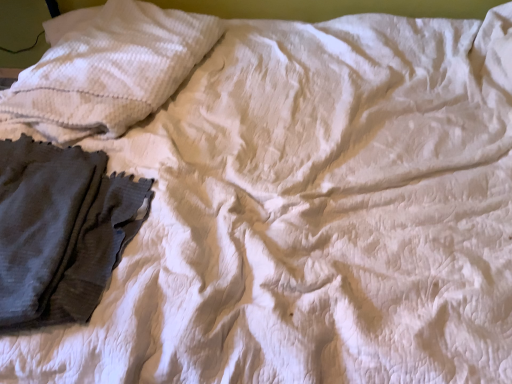
Question: Does white textured pillow at upper left have a smaller size compared to dark gray textured fabric at left?

Choices:
 (A) yes
 (B) no

Answer: (B)

Question: Is white textured pillow at upper left positioned with its back to dark gray textured fabric at left?

Choices:
 (A) no
 (B) yes

Answer: (A)

Question: Is white textured pillow at upper left thinner than dark gray textured fabric at left?

Choices:
 (A) no
 (B) yes

Answer: (A)

Question: Could you tell me if white textured pillow at upper left is turned towards dark gray textured fabric at left?

Choices:
 (A) no
 (B) yes

Answer: (A)

Question: Is dark gray textured fabric at left located within white textured pillow at upper left?

Choices:
 (A) no
 (B) yes

Answer: (A)

Question: Can you confirm if white textured pillow at upper left is wider than dark gray textured fabric at left?

Choices:
 (A) no
 (B) yes

Answer: (B)

Question: Is dark gray textured fabric at left thinner than white textured pillow at upper left?

Choices:
 (A) yes
 (B) no

Answer: (A)

Question: Is dark gray textured fabric at left taller than white textured pillow at upper left?

Choices:
 (A) yes
 (B) no

Answer: (B)

Question: Is dark gray textured fabric at left oriented away from white textured pillow at upper left?

Choices:
 (A) yes
 (B) no

Answer: (B)

Question: Can you confirm if dark gray textured fabric at left is wider than white textured pillow at upper left?

Choices:
 (A) yes
 (B) no

Answer: (B)

Question: From a real-world perspective, is dark gray textured fabric at left over white textured pillow at upper left?

Choices:
 (A) yes
 (B) no

Answer: (B)

Question: Does dark gray textured fabric at left have a larger size compared to white textured pillow at upper left?

Choices:
 (A) yes
 (B) no

Answer: (B)

Question: Is white textured pillow at upper left bigger or smaller than dark gray textured fabric at left?

Choices:
 (A) small
 (B) big

Answer: (B)